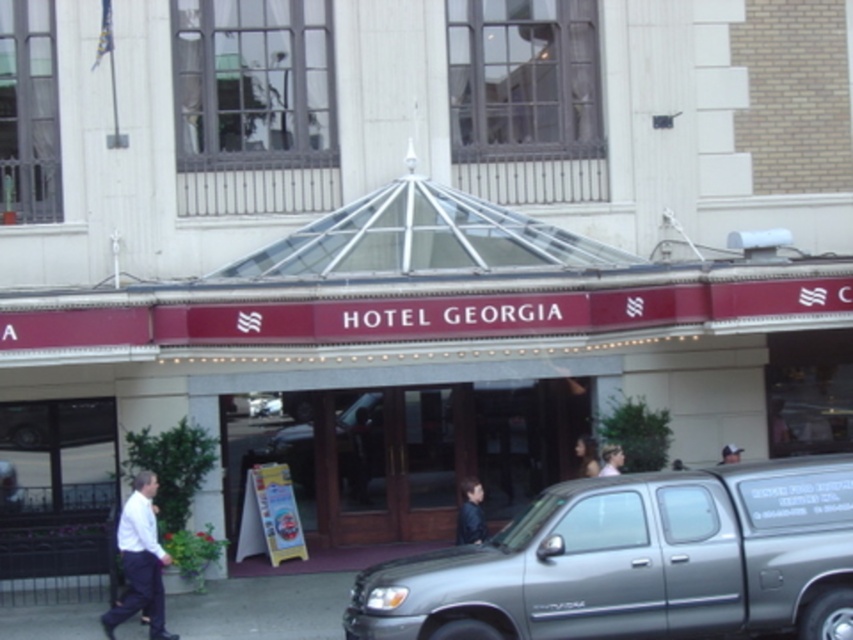
Looking at this image, you are standing at the entrance of Hotel Georgia and notice a person wearing a dark blue shirt at center. Where exactly is this person positioned relative to the entrance?

The dark blue shirt at center is located at point coordinates 0.803 along the x axis and 0.552 along the y axis relative to the entrance.

You are standing at the entrance of Hotel Georgia and see a person wearing a dark blue shirt at center and another person with smooth brown hair at center. If you want to greet both of them, which direction should you face first to ensure you can see both individuals at the same time?

Since the dark blue shirt at center and smooth brown hair at center are 8.40 feet apart from each other, you should face towards the middle point between them to see both individuals at the same time.

You are a photographer standing in front of Hotel Georgia. You notice the maroon signboard at center and the smooth brown hair at center. Which object would appear bigger in your camera viewfinder?

The maroon signboard at center is larger in size than the smooth brown hair at center, so it would appear bigger in the camera viewfinder.